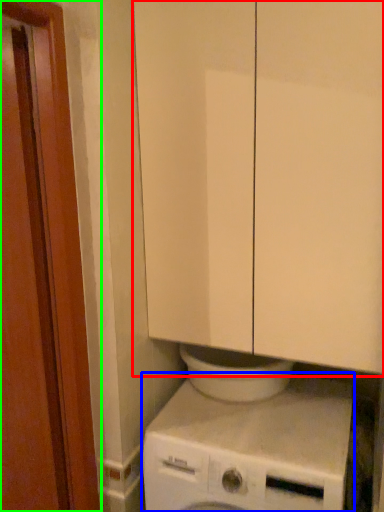
Question: Based on their relative distances, which object is nearer to cabinetry (highlighted by a red box)? Choose from washing machine (highlighted by a blue box) and screen door (highlighted by a green box).

Choices:
 (A) washing machine
 (B) screen door

Answer: (B)